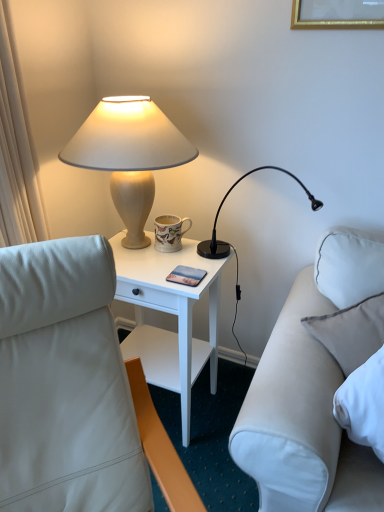
Where is `empty space that is ontop of white wood nightstand at center (from a real-world perspective)`? Image resolution: width=384 pixels, height=512 pixels. empty space that is ontop of white wood nightstand at center (from a real-world perspective) is located at coordinates tap(161, 261).